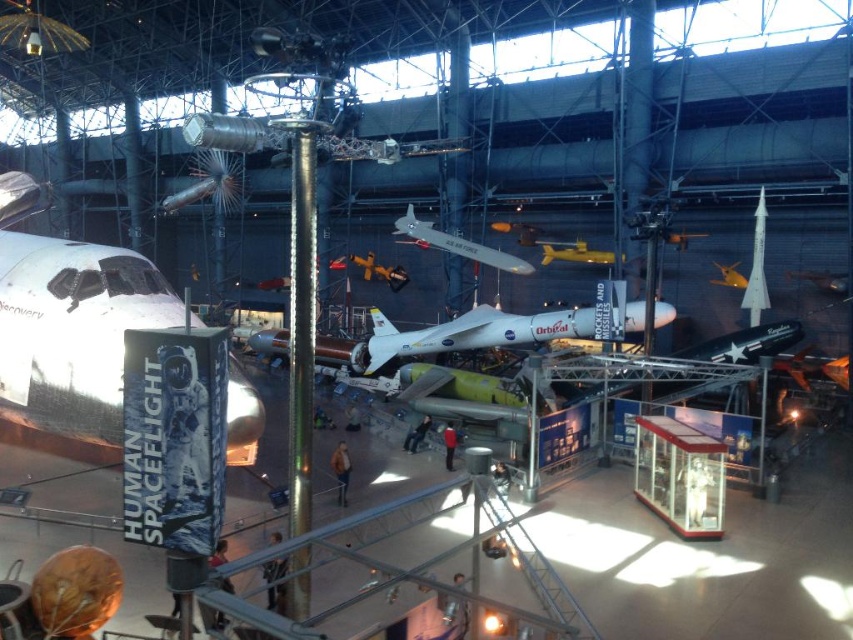
What are the coordinates of `white matte airplane at center` in the screenshot? It's located at (474, 332).

Can you confirm if white matte airplane at center is wider than metallic silver airplane at center?

Yes, white matte airplane at center is wider than metallic silver airplane at center.

Which is behind, point (482, 321) or point (674, 244)?

Point (674, 244)

You are a GUI agent. You are given a task and a screenshot of the screen. Output one action in this format:
    pyautogui.click(x=<x>, y=<y>)
    Task: Click on the white matte airplane at center
    The width and height of the screenshot is (853, 640).
    Given the screenshot: What is the action you would take?
    pyautogui.click(x=474, y=332)

Does white matte airplane at center appear on the left side of yellow matte airplane at center?

In fact, white matte airplane at center is to the right of yellow matte airplane at center.

Which is below, white matte airplane at center or yellow matte airplane at center?

Positioned lower is white matte airplane at center.

Is point (663, 316) positioned in front of point (598, 257)?

Yes, it is in front of point (598, 257).

Where is `white matte airplane at center`? white matte airplane at center is located at coordinates (474, 332).

Is white glossy airplane at center taller than shiny metallic airplane at center?

Indeed, white glossy airplane at center has a greater height compared to shiny metallic airplane at center.

Which of these two, white glossy airplane at center or shiny metallic airplane at center, stands shorter?

Standing shorter between the two is shiny metallic airplane at center.

At what (x,y) coordinates should I click in order to perform the action: click on white glossy airplane at center. Please return your answer as a coordinate pair (x, y). Looking at the image, I should click on (457, 244).